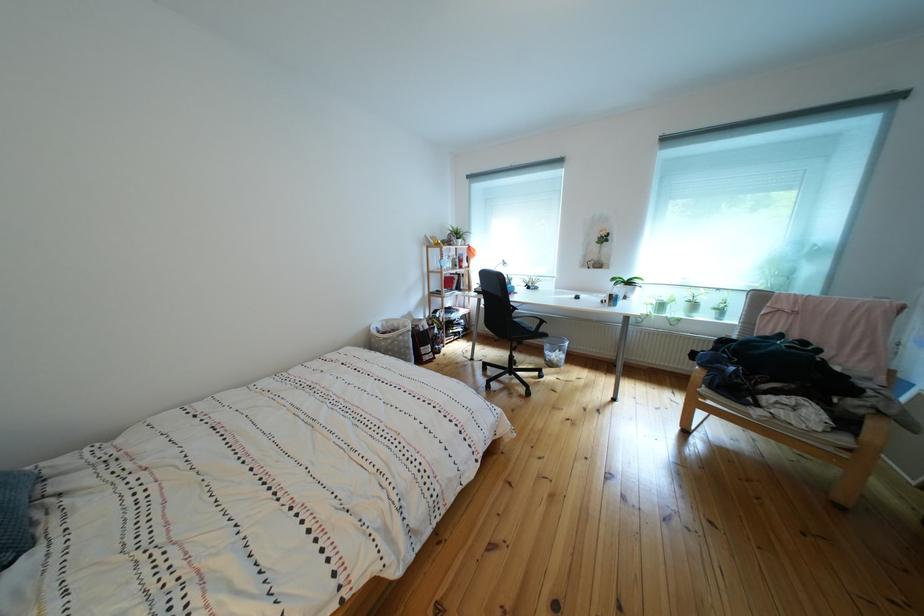
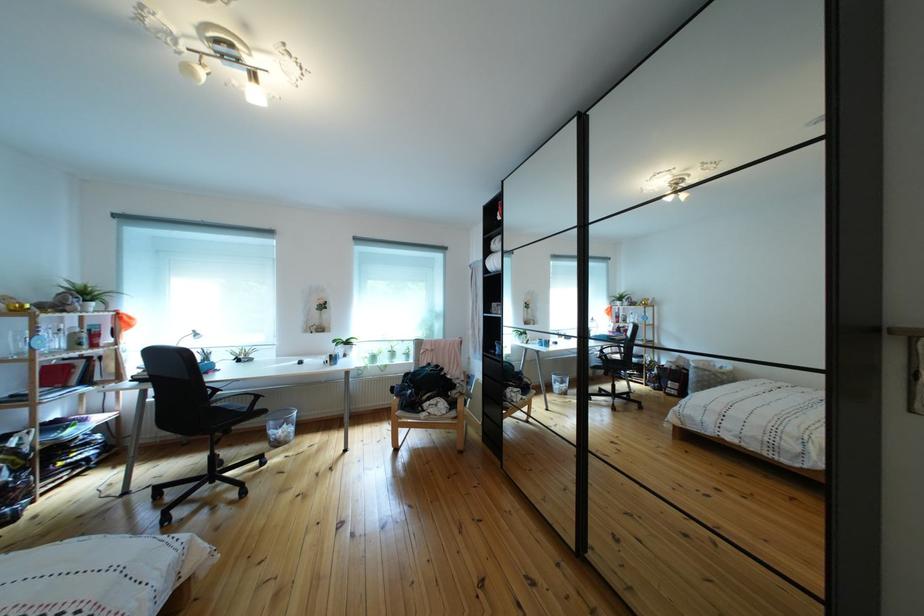
Find the pixel in the second image that matches the point at 558,352 in the first image.

(283, 430)